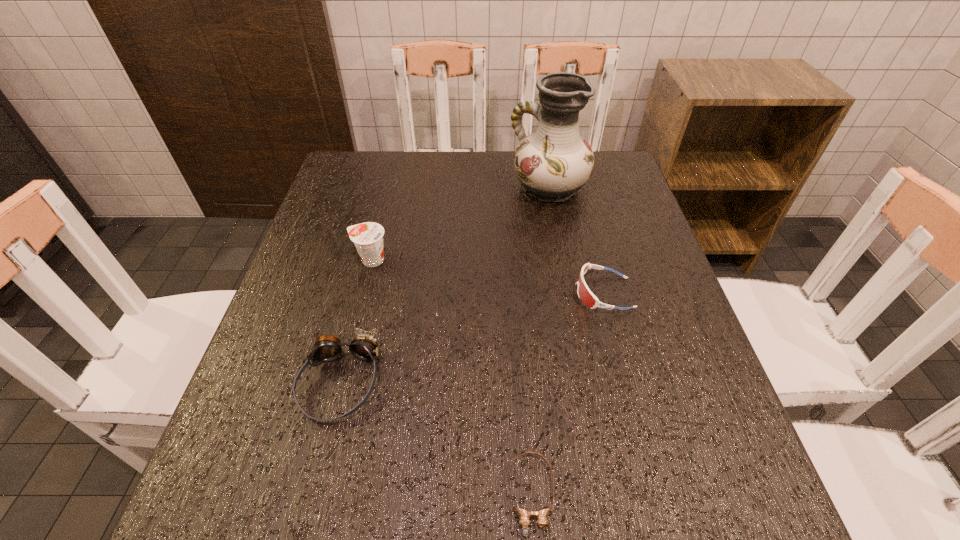
The image size is (960, 540). Find the location of `vase that is at the right edge`. vase that is at the right edge is located at coordinates (553, 163).

Locate an element on the screen. goggles that is at the right edge is located at coordinates (586, 296).

Where is `object that is at the far right corner`? Image resolution: width=960 pixels, height=540 pixels. object that is at the far right corner is located at coordinates (553, 163).

The image size is (960, 540). I want to click on vacant space at the far edge of the desktop, so click(x=513, y=163).

Where is `vacant space at the near edge`? Image resolution: width=960 pixels, height=540 pixels. vacant space at the near edge is located at coordinates (549, 488).

The image size is (960, 540). I want to click on vacant space at the left edge, so pyautogui.click(x=265, y=381).

Locate an element on the screen. Image resolution: width=960 pixels, height=540 pixels. vacant space at the right edge of the desktop is located at coordinates (691, 429).

Locate an element on the screen. This screenshot has width=960, height=540. vacant space at the far left corner of the desktop is located at coordinates (385, 163).

This screenshot has height=540, width=960. I want to click on vacant space at the near left corner of the desktop, so click(x=289, y=481).

In the image, there is a desktop. What are the coordinates of `vacant space at the far right corner` in the screenshot? It's located at (625, 194).